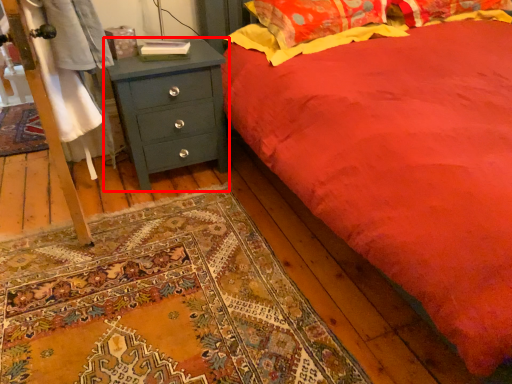
Question: From the image's perspective, what is the correct spatial relationship of chest of drawers (annotated by the red box) in relation to pillow?

Choices:
 (A) below
 (B) above

Answer: (A)